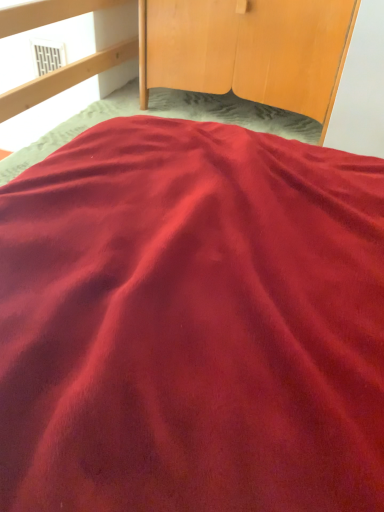
Question: From the image's perspective, is wooden wardrobe at upper center located above or below white vent at upper left?

Choices:
 (A) below
 (B) above

Answer: (A)

Question: Is wooden wardrobe at upper center bigger or smaller than white vent at upper left?

Choices:
 (A) small
 (B) big

Answer: (B)

Question: Is wooden wardrobe at upper center situated inside white vent at upper left or outside?

Choices:
 (A) outside
 (B) inside

Answer: (A)

Question: From a real-world perspective, is white vent at upper left positioned above or below wooden wardrobe at upper center?

Choices:
 (A) below
 (B) above

Answer: (A)

Question: Is white vent at upper left situated inside wooden wardrobe at upper center or outside?

Choices:
 (A) inside
 (B) outside

Answer: (B)

Question: Is white vent at upper left to the left or to the right of wooden wardrobe at upper center in the image?

Choices:
 (A) right
 (B) left

Answer: (B)

Question: Looking at their shapes, would you say white vent at upper left is wider or thinner than wooden wardrobe at upper center?

Choices:
 (A) thin
 (B) wide

Answer: (A)